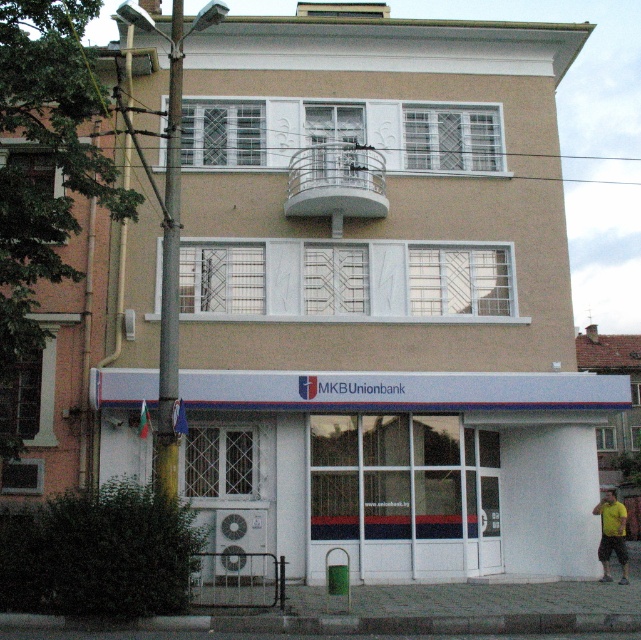
Question: Among these points, which one is nearest to the camera?

Choices:
 (A) (620, 504)
 (B) (165, 284)
 (C) (279, 481)

Answer: (B)

Question: Which of the following is the closest to the observer?

Choices:
 (A) green painted metal pole at left
 (B) white glossy storefront at center
 (C) yellow t-shirt at lower right

Answer: (A)

Question: Which of the following is the farthest from the observer?

Choices:
 (A) yellow t-shirt at lower right
 (B) green painted metal pole at left
 (C) white glossy storefront at center

Answer: (C)

Question: Observing the image, what is the correct spatial positioning of white glossy storefront at center in reference to yellow t-shirt at lower right?

Choices:
 (A) left
 (B) right

Answer: (A)

Question: Does white glossy storefront at center come in front of yellow t-shirt at lower right?

Choices:
 (A) no
 (B) yes

Answer: (A)

Question: Does green painted metal pole at left appear over yellow t-shirt at lower right?

Choices:
 (A) no
 (B) yes

Answer: (B)